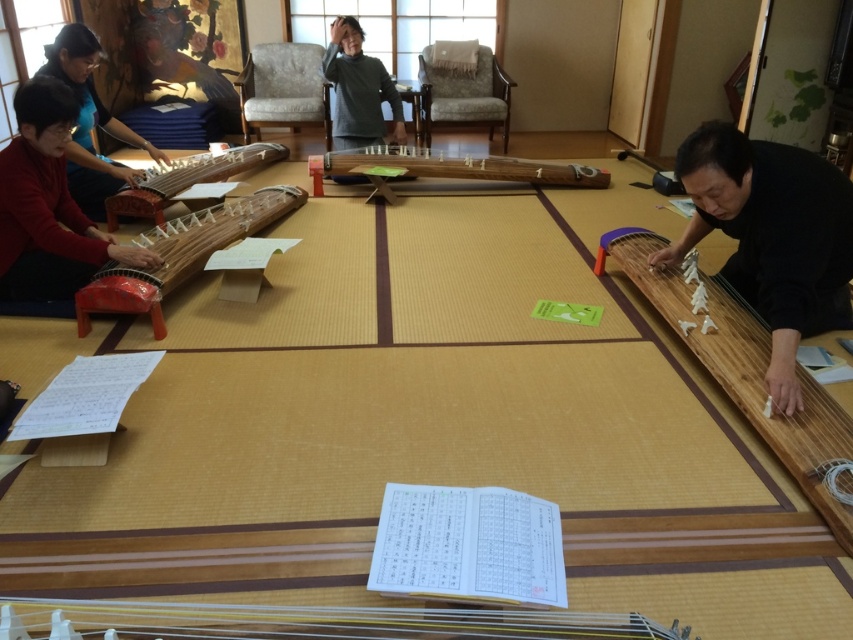
You are a performer preparing for a traditional Japanese music performance. You need to move from the black matte guzheng at right to the matte black koto at left during your act. Given that you can move at a speed of 0.5 meters per second, how many seconds will it take you to walk directly between them?

The distance between the black matte guzheng at right and the matte black koto at left is 3.47 meters. At a speed of 0.5 meters per second, it would take 6.94 seconds to walk between them.

You are a student in the room and want to pick up the closest instrument to you. Which one should you choose between the black matte guzheng at right and the wooden stringed instrument at center?

The black matte guzheng at right is closer to the viewer than the wooden stringed instrument at center, so you should choose the black matte guzheng at right.